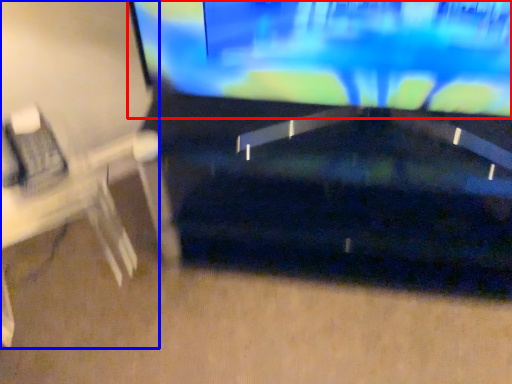
Question: Which object is closer to the camera taking this photo, television (highlighted by a red box) or computer desk (highlighted by a blue box)?

Choices:
 (A) television
 (B) computer desk

Answer: (A)